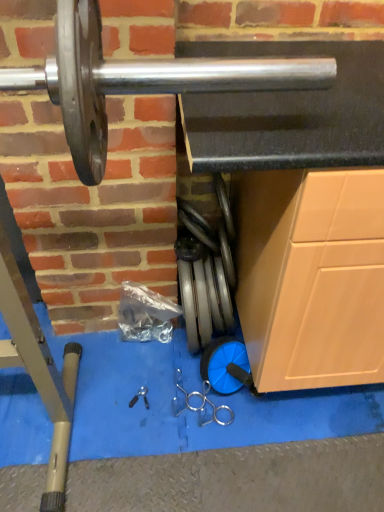
Question: From a real-world perspective, is silver metallic weight at center, placed as the 2th tool when sorted from left to right, positioned above or below black plastic tool at center, which appears as the 2th tool when viewed from the right?

Choices:
 (A) below
 (B) above

Answer: (B)

Question: From their relative heights in the image, would you say silver metallic weight at center, which is the 1th tool from right to left, is taller or shorter than black plastic tool at center, which appears as the 2th tool when viewed from the right?

Choices:
 (A) short
 (B) tall

Answer: (B)

Question: Based on their positions, is silver metallic weight at center, placed as the 2th tool when sorted from left to right, located to the left or right of black plastic tool at center, which is the first tool in left-to-right order?

Choices:
 (A) left
 (B) right

Answer: (B)

Question: In terms of width, does black plastic tool at center, which is the first tool in left-to-right order, look wider or thinner when compared to silver metallic weight at center, placed as the 2th tool when sorted from left to right?

Choices:
 (A) wide
 (B) thin

Answer: (B)

Question: Do you think black plastic tool at center, which is the first tool in left-to-right order, is within silver metallic weight at center, which is the 1th tool from right to left, or outside of it?

Choices:
 (A) inside
 (B) outside

Answer: (B)

Question: From the image's perspective, is black plastic tool at center, which appears as the 2th tool when viewed from the right, above or below silver metallic weight at center, which is the 1th tool from right to left?

Choices:
 (A) above
 (B) below

Answer: (B)

Question: Is black plastic tool at center, which appears as the 2th tool when viewed from the right, bigger or smaller than silver metallic weight at center, which is the 1th tool from right to left?

Choices:
 (A) big
 (B) small

Answer: (B)